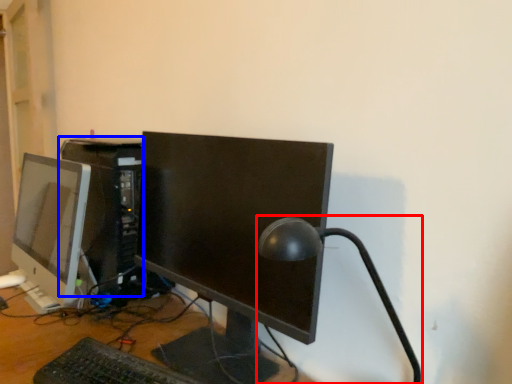
Question: Which object appears farthest to the camera in this image, table lamp (highlighted by a red box) or computer tower (highlighted by a blue box)?

Choices:
 (A) table lamp
 (B) computer tower

Answer: (B)